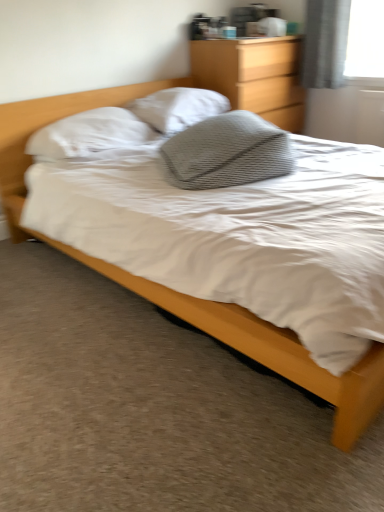
Question: Is wooden dresser at upper center located outside matte wood bed at center?

Choices:
 (A) no
 (B) yes

Answer: (B)

Question: Is wooden dresser at upper center positioned behind matte wood bed at center?

Choices:
 (A) no
 (B) yes

Answer: (B)

Question: Is wooden dresser at upper center looking in the opposite direction of matte wood bed at center?

Choices:
 (A) no
 (B) yes

Answer: (A)

Question: Considering the relative sizes of wooden dresser at upper center and matte wood bed at center in the image provided, is wooden dresser at upper center shorter than matte wood bed at center?

Choices:
 (A) yes
 (B) no

Answer: (B)

Question: Is wooden dresser at upper center not near matte wood bed at center?

Choices:
 (A) no
 (B) yes

Answer: (B)

Question: Is the position of wooden dresser at upper center less distant than that of matte wood bed at center?

Choices:
 (A) yes
 (B) no

Answer: (B)

Question: Considering the relative sizes of wooden dresser at upper center and white textured pillow at center, which is the 3th pillow in front-to-back order, in the image provided, is wooden dresser at upper center shorter than white textured pillow at center, which is the 3th pillow in front-to-back order,?

Choices:
 (A) yes
 (B) no

Answer: (B)

Question: Is the depth of wooden dresser at upper center less than that of white textured pillow at center, arranged as the 1th pillow when viewed from the back?

Choices:
 (A) no
 (B) yes

Answer: (A)

Question: Does wooden dresser at upper center have a greater width compared to white textured pillow at center, which is the 3th pillow in front-to-back order?

Choices:
 (A) yes
 (B) no

Answer: (A)

Question: Is wooden dresser at upper center surrounding white textured pillow at center, which is the 3th pillow in front-to-back order?

Choices:
 (A) yes
 (B) no

Answer: (B)

Question: Is wooden dresser at upper center positioned far away from white textured pillow at center, which is the 3th pillow in front-to-back order?

Choices:
 (A) no
 (B) yes

Answer: (A)

Question: From a real-world perspective, is wooden dresser at upper center physically below white textured pillow at center, which is the 3th pillow in front-to-back order?

Choices:
 (A) no
 (B) yes

Answer: (B)

Question: Considering the relative sizes of gray textured pillow at center, the third pillow when ordered from back to front, and white soft pillow at upper left, which is counted as the 2th pillow, starting from the back, in the image provided, is gray textured pillow at center, the third pillow when ordered from back to front, thinner than white soft pillow at upper left, which is counted as the 2th pillow, starting from the back,?

Choices:
 (A) yes
 (B) no

Answer: (B)